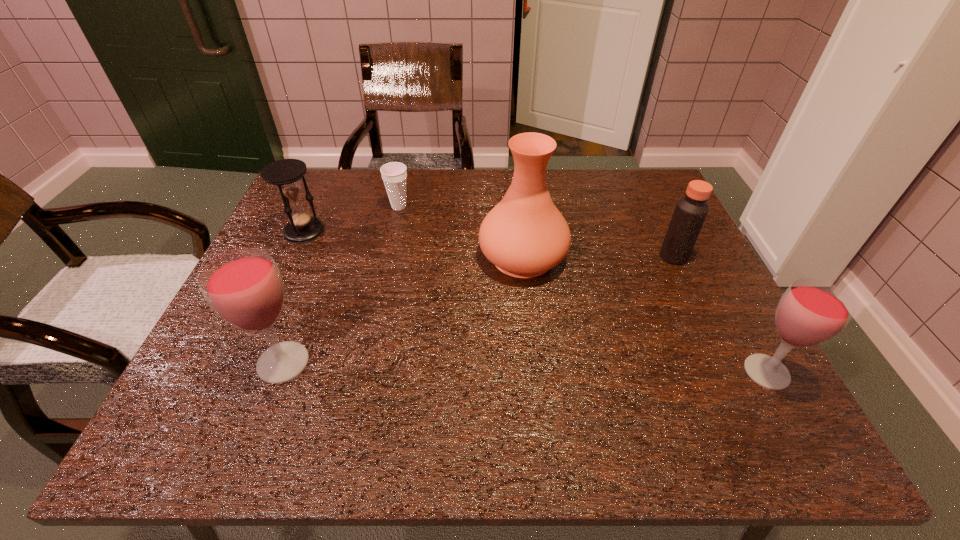
The image size is (960, 540). Find the location of `object present at the near left corner`. object present at the near left corner is located at coordinates (244, 287).

Identify the location of object that is at the near right corner. (811, 311).

You are a GUI agent. You are given a task and a screenshot of the screen. Output one action in this format:
    pyautogui.click(x=<x>, y=<y>)
    Task: Click on the vacant space at the far edge of the desktop
    
    Given the screenshot: What is the action you would take?
    pyautogui.click(x=449, y=197)

You are a GUI agent. You are given a task and a screenshot of the screen. Output one action in this format:
    pyautogui.click(x=<x>, y=<y>)
    Task: Click on the vacant space at the near edge of the desktop
    
    Given the screenshot: What is the action you would take?
    tap(342, 389)

Where is `free space at the left edge of the desktop`? free space at the left edge of the desktop is located at coordinates (228, 341).

At what (x,y) coordinates should I click in order to perform the action: click on vacant space at the far left corner of the desktop. Please return your answer as a coordinate pair (x, y). The width and height of the screenshot is (960, 540). Looking at the image, I should click on (339, 205).

At what (x,y) coordinates should I click in order to perform the action: click on vacant area at the near right corner of the desktop. Please return your answer as a coordinate pair (x, y). The image size is (960, 540). Looking at the image, I should click on (726, 377).

You are a GUI agent. You are given a task and a screenshot of the screen. Output one action in this format:
    pyautogui.click(x=<x>, y=<y>)
    Task: Click on the empty location between the shortest object and the hourglass
    The height and width of the screenshot is (540, 960).
    Given the screenshot: What is the action you would take?
    pyautogui.click(x=351, y=219)

The height and width of the screenshot is (540, 960). I want to click on empty space between the vinegar and the vase, so click(598, 256).

You are a GUI agent. You are given a task and a screenshot of the screen. Output one action in this format:
    pyautogui.click(x=<x>, y=<y>)
    Task: Click on the vacant space that's between the third object from left to right and the second tallest object
    
    Given the screenshot: What is the action you would take?
    pyautogui.click(x=341, y=285)